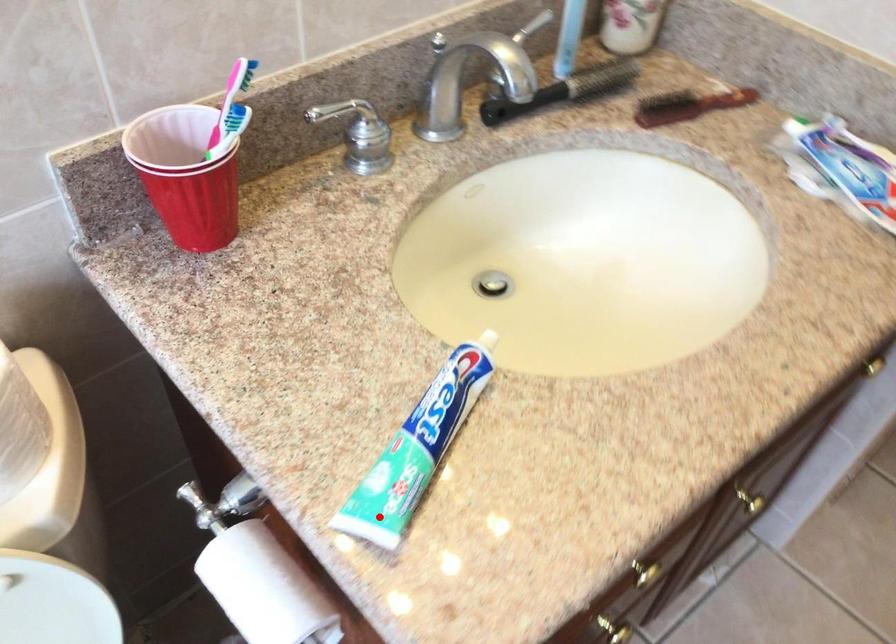
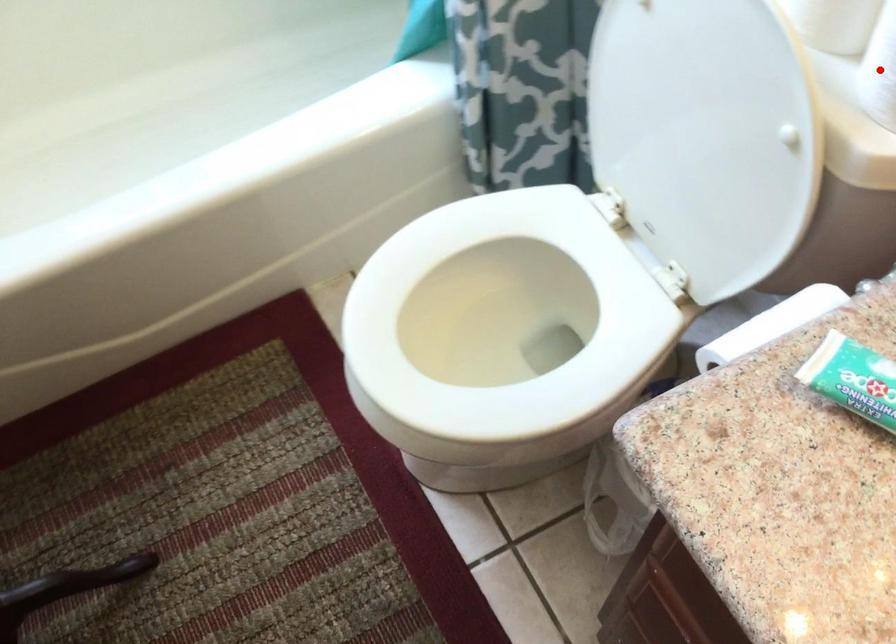
I am providing you with two images of the same scene from different viewpoints. A red point is marked on the first image and another point is marked on the second image. Is the marked point in image1 the same physical position as the marked point in image2?

No